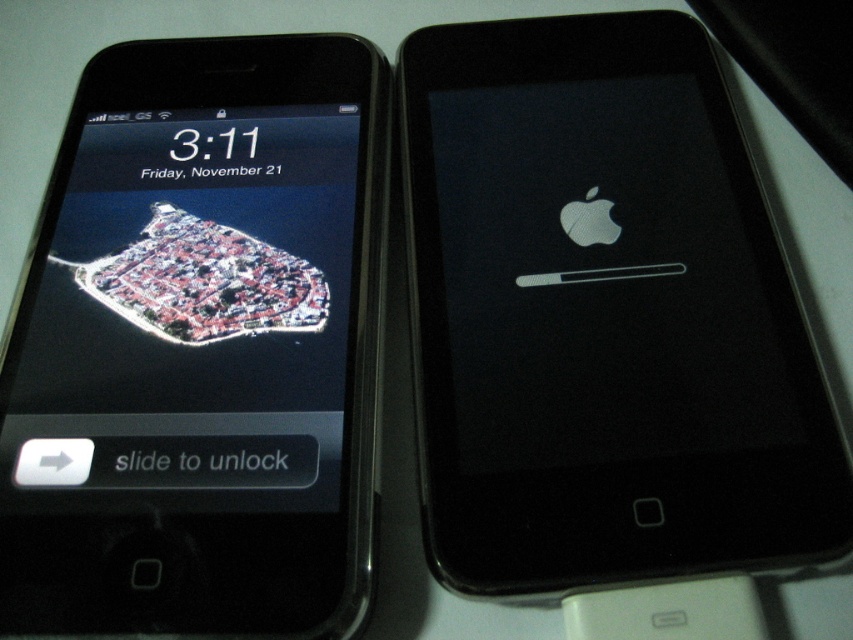
At what (x,y) coordinates should I click in order to perform the action: click on black matte iphone at right. Please return your answer as a coordinate pair (x, y). Looking at the image, I should click on (602, 316).

From the picture: Is black matte iphone at right below black glossy smartphone at left?

Incorrect, black matte iphone at right is not positioned below black glossy smartphone at left.

Between point (706, 333) and point (128, 465), which one is positioned behind?

Point (706, 333)

You are a GUI agent. You are given a task and a screenshot of the screen. Output one action in this format:
    pyautogui.click(x=<x>, y=<y>)
    Task: Click on the black matte iphone at right
    
    Given the screenshot: What is the action you would take?
    pyautogui.click(x=602, y=316)